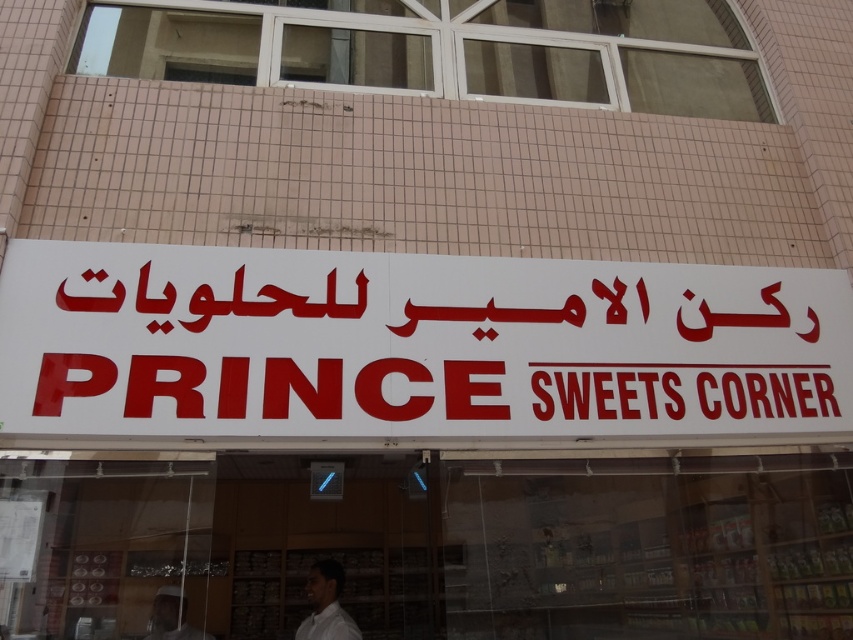
Can you confirm if transparent glass storefront at center is positioned below white matte man at center?

Correct, transparent glass storefront at center is located below white matte man at center.

Does transparent glass storefront at center have a greater width compared to white matte man at center?

Yes, transparent glass storefront at center is wider than white matte man at center.

Measure the distance between point (10, 465) and camera.

They are 9.78 feet apart.

You are a GUI agent. You are given a task and a screenshot of the screen. Output one action in this format:
    pyautogui.click(x=<x>, y=<y>)
    Task: Click on the transparent glass storefront at center
    Image resolution: width=853 pixels, height=640 pixels.
    Given the screenshot: What is the action you would take?
    pyautogui.click(x=457, y=545)

Who is shorter, transparent glass storefront at center or white matte shirt at lower center?

With less height is white matte shirt at lower center.

Which of these two, transparent glass storefront at center or white matte shirt at lower center, stands taller?

transparent glass storefront at center

In order to click on transparent glass storefront at center in this screenshot , I will do `click(457, 545)`.

Can you confirm if white matte signboard at center is shorter than white matte man at center?

In fact, white matte signboard at center may be taller than white matte man at center.

Is white matte signboard at center behind white matte man at center?

That is False.

Between point (468, 259) and point (157, 625), which one is positioned behind?

Point (157, 625)

Locate an element on the screen. This screenshot has height=640, width=853. white matte signboard at center is located at coordinates (412, 344).